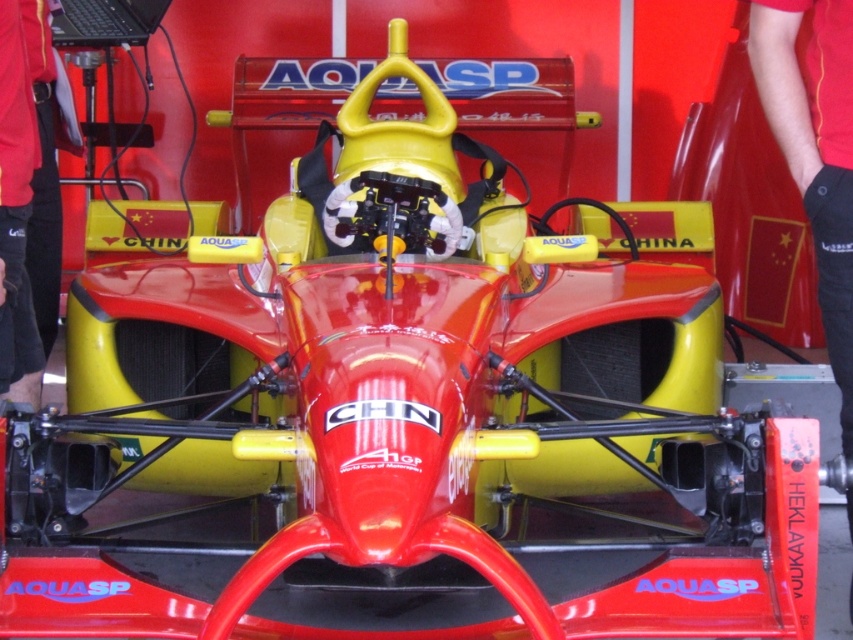
Question: Among these points, which one is farthest from the camera?

Choices:
 (A) (15, 282)
 (B) (828, 1)

Answer: (A)

Question: Can you confirm if red cotton shirt at center is positioned to the left of red fabric pants at lower left?

Choices:
 (A) no
 (B) yes

Answer: (A)

Question: Does red cotton shirt at center come in front of red fabric pants at lower left?

Choices:
 (A) no
 (B) yes

Answer: (B)

Question: Which object is farther from the camera taking this photo?

Choices:
 (A) red cotton shirt at center
 (B) red fabric pants at lower left

Answer: (B)

Question: Can you confirm if red cotton shirt at center is positioned below red fabric pants at lower left?

Choices:
 (A) no
 (B) yes

Answer: (B)